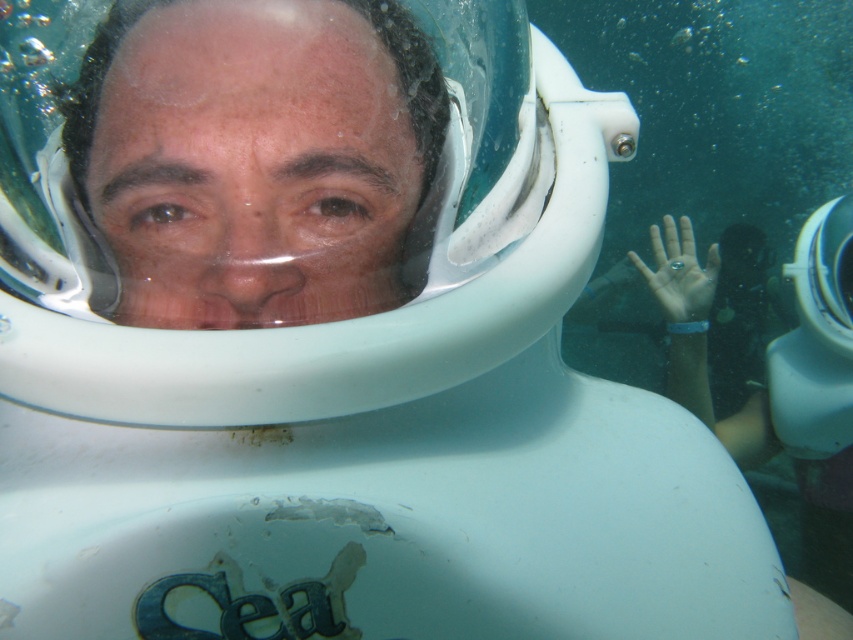
Is matte plastic face at center shorter than clear plastic ring at center?

Yes.

Is point (201, 204) positioned after point (640, 259)?

No.

Locate an element on the screen. matte plastic face at center is located at coordinates pyautogui.click(x=254, y=157).

The width and height of the screenshot is (853, 640). I want to click on matte plastic face at center, so click(x=254, y=157).